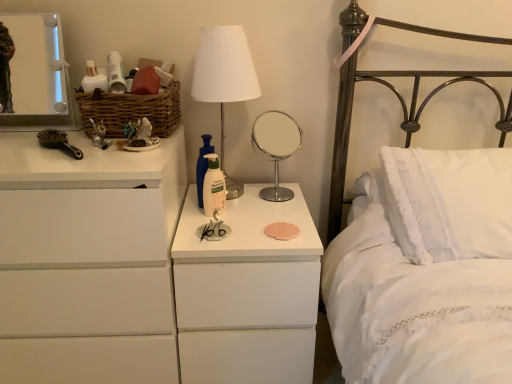
Question: From a real-world perspective, is white fabric lampshade at center positioned under metallic rectangular mirror at upper left, which is the first mirror from top to bottom, based on gravity?

Choices:
 (A) yes
 (B) no

Answer: (A)

Question: Is white fabric lampshade at center shorter than metallic rectangular mirror at upper left, which is the first mirror from top to bottom?

Choices:
 (A) no
 (B) yes

Answer: (A)

Question: Could metallic rectangular mirror at upper left, which is the 2th mirror in bottom-to-top order, be considered to be inside white fabric lampshade at center?

Choices:
 (A) no
 (B) yes

Answer: (A)

Question: Is the position of white fabric lampshade at center less distant than that of metallic rectangular mirror at upper left, the first mirror in the left-to-right sequence?

Choices:
 (A) yes
 (B) no

Answer: (A)

Question: From a real-world perspective, is white fabric lampshade at center on metallic rectangular mirror at upper left, which is the first mirror from top to bottom?

Choices:
 (A) no
 (B) yes

Answer: (A)

Question: Considering the relative sizes of white fabric lampshade at center and metallic rectangular mirror at upper left, the first mirror in the left-to-right sequence, in the image provided, is white fabric lampshade at center thinner than metallic rectangular mirror at upper left, the first mirror in the left-to-right sequence,?

Choices:
 (A) yes
 (B) no

Answer: (B)

Question: From the image's perspective, does white matte lotion at center appear lower than metallic silver toy at left, the first toy in the left-to-right sequence?

Choices:
 (A) yes
 (B) no

Answer: (A)

Question: Can you confirm if white matte lotion at center is positioned to the left of metallic silver toy at left, the 2th toy in the right-to-left sequence?

Choices:
 (A) yes
 (B) no

Answer: (B)

Question: Does white matte lotion at center have a greater width compared to metallic silver toy at left, the first toy in the left-to-right sequence?

Choices:
 (A) no
 (B) yes

Answer: (A)

Question: Does white matte lotion at center turn towards metallic silver toy at left, the 2th toy in the right-to-left sequence?

Choices:
 (A) yes
 (B) no

Answer: (B)

Question: Is metallic silver toy at left, the 2th toy in the right-to-left sequence, completely or partially inside white matte lotion at center?

Choices:
 (A) yes
 (B) no

Answer: (B)

Question: Is white matte lotion at center shorter than metallic silver toy at left, the 2th toy in the right-to-left sequence?

Choices:
 (A) no
 (B) yes

Answer: (A)

Question: Does white matte lotion at center have a greater height compared to white matte chest of drawers at left?

Choices:
 (A) yes
 (B) no

Answer: (B)